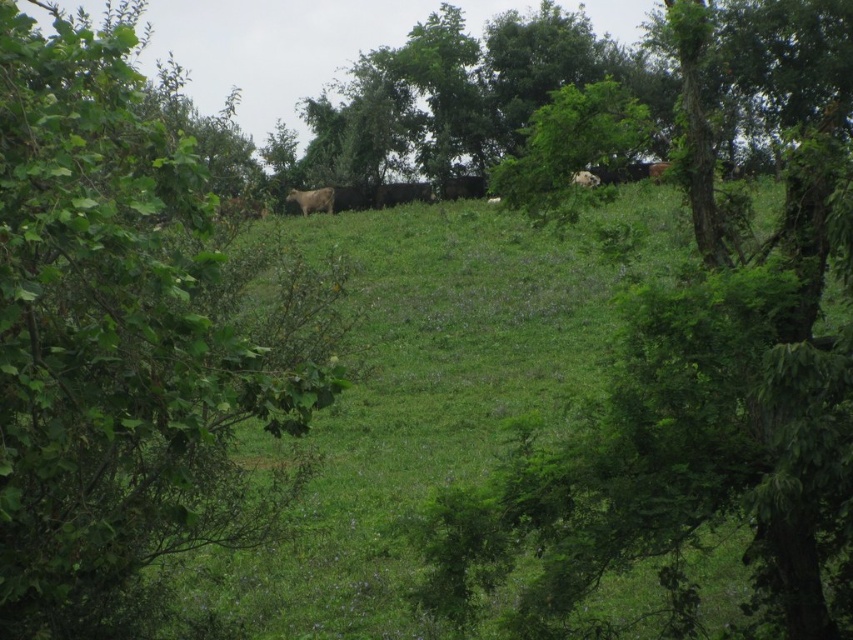
You are standing at the point marked by the coordinates point (700, 376) in the image. Looking around, you see a green leafy tree at center. What is the nearest object to your current position?

The nearest object to your current position at point (700, 376) is the green leafy tree at center, as the point directly indicates its location.